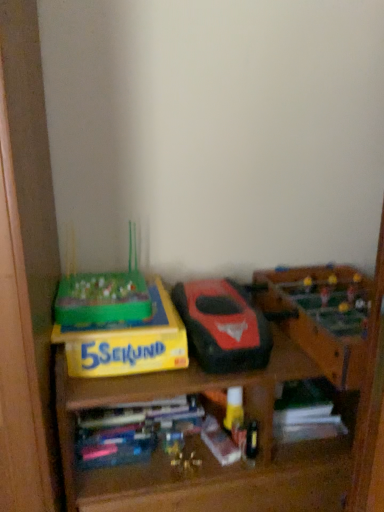
Identify the location of yellow matte board game at left. The height and width of the screenshot is (512, 384). (127, 342).

Find the location of a particular element. Image resolution: width=384 pixels, height=512 pixels. yellow cardboard box at left is located at coordinates (205, 447).

In order to face matte black toy car at center, which ranks as the first toy in left-to-right order, should I rotate leftwards or rightwards?

A 3.257 degree turn to the right will do.

Identify the location of wooden foosball table at right, which is the 2th toy in left-to-right order. (324, 315).

Is yellow cardboard box at left spatially inside matte black toy car at center, arranged as the second toy when viewed from the right, or outside of it?

yellow cardboard box at left is not inside matte black toy car at center, arranged as the second toy when viewed from the right, it's outside.

Is yellow cardboard box at left to the right of matte black toy car at center, arranged as the second toy when viewed from the right, from the viewer's perspective?

Yes.

Is yellow cardboard box at left directly adjacent to matte black toy car at center, arranged as the second toy when viewed from the right?

yellow cardboard box at left and matte black toy car at center, arranged as the second toy when viewed from the right, are clearly separated.

From a real-world perspective, is yellow cardboard box at left positioned above or below matte black toy car at center, which ranks as the first toy in left-to-right order?

From a real-world perspective, yellow cardboard box at left is physically below matte black toy car at center, which ranks as the first toy in left-to-right order.

From a real-world perspective, is white matte book at lower right, marked as the 2th book in a left-to-right arrangement, on top of yellow cardboard box at left?

Yes, from a real-world perspective, white matte book at lower right, marked as the 2th book in a left-to-right arrangement, is above yellow cardboard box at left.

Is the depth of white matte book at lower right, marked as the 2th book in a left-to-right arrangement, greater than that of yellow cardboard box at left?

Yes.

Is yellow matte board game at left touching multicolored plastic books at center, acting as the 1th book starting from the left?

yellow matte board game at left and multicolored plastic books at center, acting as the 1th book starting from the left, are clearly separated.

From the picture: From the image's perspective, would you say yellow matte board game at left is shown under multicolored plastic books at center, acting as the 1th book starting from the left?

Incorrect, from the image's perspective, yellow matte board game at left is higher than multicolored plastic books at center, acting as the 1th book starting from the left.

Between point (287, 434) and point (141, 448), which one is positioned behind?

Positioned behind is point (287, 434).

Can you confirm if white matte book at lower right, marked as the 2th book in a left-to-right arrangement, is bigger than multicolored plastic books at center, acting as the 1th book starting from the left?

Incorrect, white matte book at lower right, marked as the 2th book in a left-to-right arrangement, is not larger than multicolored plastic books at center, acting as the 1th book starting from the left.

This screenshot has width=384, height=512. Identify the location of book located above the multicolored plastic books at center, placed as the 2th book when sorted from right to left (from the image's perspective). (306, 412).

Is white matte book at lower right, acting as the 1th book starting from the right, not within multicolored plastic books at center, placed as the 2th book when sorted from right to left?

Indeed, white matte book at lower right, acting as the 1th book starting from the right, is completely outside multicolored plastic books at center, placed as the 2th book when sorted from right to left.

Is yellow cardboard box at left not inside yellow matte board game at left?

yellow cardboard box at left is positioned outside yellow matte board game at left.

From the image's perspective, is yellow cardboard box at left positioned above or below yellow matte board game at left?

Based on their image positions, yellow cardboard box at left is located beneath yellow matte board game at left.

Can you confirm if yellow cardboard box at left is wider than yellow matte board game at left?

Correct, the width of yellow cardboard box at left exceeds that of yellow matte board game at left.

Does point (191, 371) come behind point (147, 371)?

That is True.

From the image's perspective, is multicolored plastic books at center, acting as the 1th book starting from the left, above or below yellow matte board game at left?

multicolored plastic books at center, acting as the 1th book starting from the left, is situated lower than yellow matte board game at left in the image.

Consider the image. In terms of width, does multicolored plastic books at center, placed as the 2th book when sorted from right to left, look wider or thinner when compared to yellow matte board game at left?

Considering their sizes, multicolored plastic books at center, placed as the 2th book when sorted from right to left, looks slimmer than yellow matte board game at left.

Is multicolored plastic books at center, acting as the 1th book starting from the left, taller or shorter than yellow matte board game at left?

Clearly, multicolored plastic books at center, acting as the 1th book starting from the left, is shorter compared to yellow matte board game at left.

Is yellow matte board game at left at the left side of white matte book at lower right, acting as the 1th book starting from the right?

Yes, yellow matte board game at left is to the left of white matte book at lower right, acting as the 1th book starting from the right.

Can white matte book at lower right, marked as the 2th book in a left-to-right arrangement, be found inside yellow matte board game at left?

No, white matte book at lower right, marked as the 2th book in a left-to-right arrangement, is located outside of yellow matte board game at left.

Which of these two, yellow matte board game at left or white matte book at lower right, acting as the 1th book starting from the right, is wider?

yellow matte board game at left is wider.

Can you tell me how much yellow matte board game at left and white matte book at lower right, acting as the 1th book starting from the right, differ in facing direction?

The facing directions of yellow matte board game at left and white matte book at lower right, acting as the 1th book starting from the right, are 4.13 degrees apart.

This screenshot has width=384, height=512. Find the location of `shelf below the matte black toy car at center, which ranks as the first toy in left-to-right order (from the image's perspective)`. shelf below the matte black toy car at center, which ranks as the first toy in left-to-right order (from the image's perspective) is located at coordinates (205, 447).

You are a GUI agent. You are given a task and a screenshot of the screen. Output one action in this format:
    pyautogui.click(x=<x>, y=<y>)
    Task: Click on the 1st book directly above the yellow cardboard box at left (from a real-world perspective)
    
    Given the screenshot: What is the action you would take?
    pyautogui.click(x=306, y=412)

From the image, which object appears to be farther from multicolored plastic books at center, placed as the 2th book when sorted from right to left, wooden foosball table at right, which is the 2th toy in left-to-right order, or yellow cardboard box at left?

The object further to multicolored plastic books at center, placed as the 2th book when sorted from right to left, is wooden foosball table at right, which is the 2th toy in left-to-right order.

Which object lies nearer to the anchor point multicolored plastic books at center, acting as the 1th book starting from the left, matte black toy car at center, which ranks as the first toy in left-to-right order, or yellow matte board game at left?

The object closer to multicolored plastic books at center, acting as the 1th book starting from the left, is yellow matte board game at left.

In the scene shown: From the image, which object appears to be farther from matte black toy car at center, arranged as the second toy when viewed from the right, multicolored plastic books at center, placed as the 2th book when sorted from right to left, or yellow matte board game at left?

The object further to matte black toy car at center, arranged as the second toy when viewed from the right, is multicolored plastic books at center, placed as the 2th book when sorted from right to left.

Considering their positions, is yellow matte board game at left positioned closer to multicolored plastic books at center, placed as the 2th book when sorted from right to left, than white matte book at lower right, marked as the 2th book in a left-to-right arrangement?

yellow matte board game at left.

From the picture: When comparing their distances from matte black toy car at center, arranged as the second toy when viewed from the right, does yellow cardboard box at left or multicolored plastic books at center, acting as the 1th book starting from the left, seem closer?

Based on the image, yellow cardboard box at left appears to be nearer to matte black toy car at center, arranged as the second toy when viewed from the right.

Looking at the image, which one is located closer to multicolored plastic books at center, placed as the 2th book when sorted from right to left, matte black toy car at center, arranged as the second toy when viewed from the right, or yellow cardboard box at left?

yellow cardboard box at left is positioned closer to the anchor multicolored plastic books at center, placed as the 2th book when sorted from right to left.

When comparing their distances from yellow cardboard box at left, does multicolored plastic books at center, acting as the 1th book starting from the left, or matte black toy car at center, arranged as the second toy when viewed from the right, seem closer?

The object closer to yellow cardboard box at left is multicolored plastic books at center, acting as the 1th book starting from the left.

When comparing their distances from wooden foosball table at right, arranged as the first toy when viewed from the right, does yellow matte board game at left or yellow cardboard box at left seem further?

Based on the image, yellow matte board game at left appears to be further to wooden foosball table at right, arranged as the first toy when viewed from the right.

What are the coordinates of `cardboard box between matte black toy car at center, arranged as the second toy when viewed from the right, and yellow cardboard box at left vertically` in the screenshot? It's located at (127, 342).

Locate an element on the screen. The width and height of the screenshot is (384, 512). book located between multicolored plastic books at center, acting as the 1th book starting from the left, and wooden foosball table at right, arranged as the first toy when viewed from the right, in the left-right direction is located at coordinates (306, 412).

Image resolution: width=384 pixels, height=512 pixels. Find the location of `book situated between yellow matte board game at left and white matte book at lower right, acting as the 1th book starting from the right, from left to right`. book situated between yellow matte board game at left and white matte book at lower right, acting as the 1th book starting from the right, from left to right is located at coordinates (131, 430).

You are a GUI agent. You are given a task and a screenshot of the screen. Output one action in this format:
    pyautogui.click(x=<x>, y=<y>)
    Task: Click on the toy between wooden foosball table at right, which is the 2th toy in left-to-right order, and yellow cardboard box at left in the up-down direction
    This screenshot has height=512, width=384.
    Given the screenshot: What is the action you would take?
    pyautogui.click(x=223, y=326)